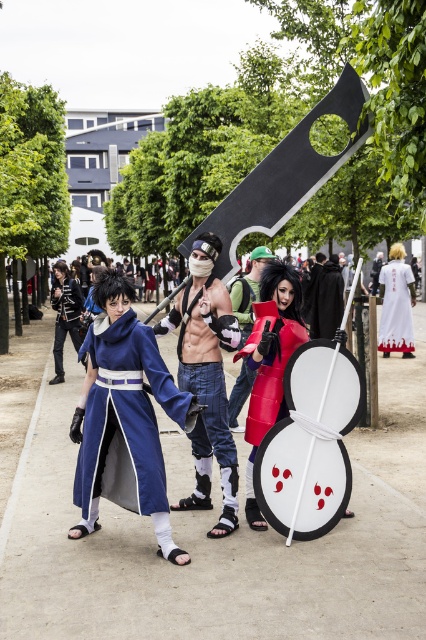
Question: Does matte blue fabric coat at left appear under matte black armor at left?

Choices:
 (A) no
 (B) yes

Answer: (B)

Question: Among these points, which one is nearest to the camera?

Choices:
 (A) (259, 518)
 (B) (236, 410)
 (C) (158, 330)

Answer: (A)

Question: Which point is closer to the camera?

Choices:
 (A) (209, 236)
 (B) (400, 268)

Answer: (A)

Question: Observing the image, what is the correct spatial positioning of matte blue fabric coat at left in reference to matte red shield at center?

Choices:
 (A) right
 (B) left

Answer: (B)

Question: In this image, where is matte red shield at center located relative to white matte dress at right?

Choices:
 (A) above
 (B) below

Answer: (B)

Question: Which object appears farthest from the camera in this image?

Choices:
 (A) matte blue fabric coat at left
 (B) matte black sword at center

Answer: (B)